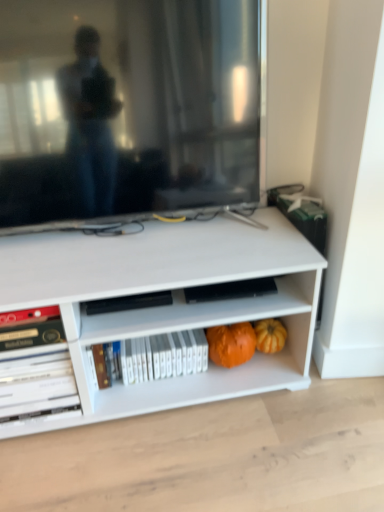
Locate an element on the screen. The width and height of the screenshot is (384, 512). unoccupied region to the right of white glossy book at lower left, the first book from the left is located at coordinates (99, 424).